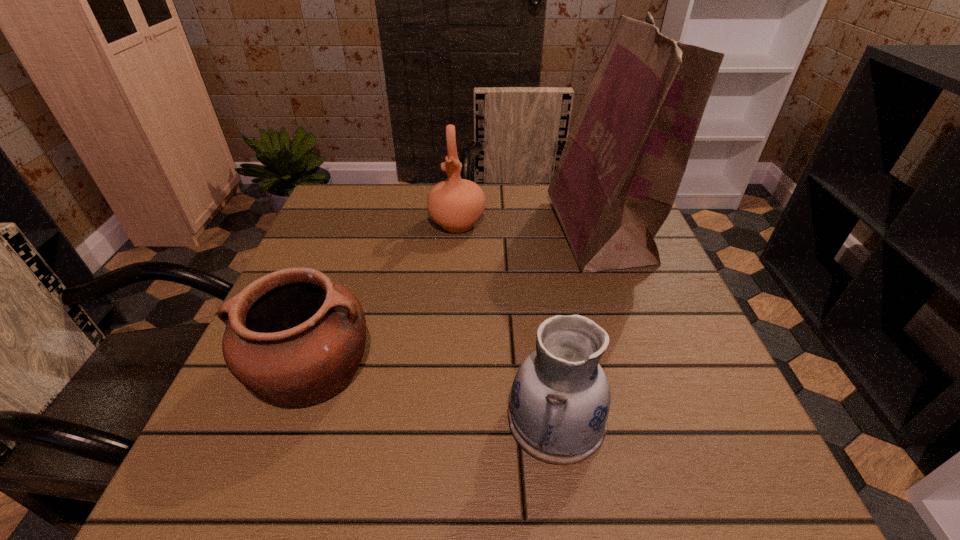
You are a GUI agent. You are given a task and a screenshot of the screen. Output one action in this format:
    pyautogui.click(x=<x>, y=<y>)
    Task: Click on the vacant space that satisfies the following two spatial constraints: 1. on the front-facing side of the tallest object; 2. on the front side of the rightmost pottery
    
    Given the screenshot: What is the action you would take?
    pyautogui.click(x=664, y=418)

This screenshot has height=540, width=960. What are the coordinates of `vacant space that satisfies the following two spatial constraints: 1. on the spout of the rightmost pottery; 2. on the left side of the farthest pottery` in the screenshot? It's located at (444, 418).